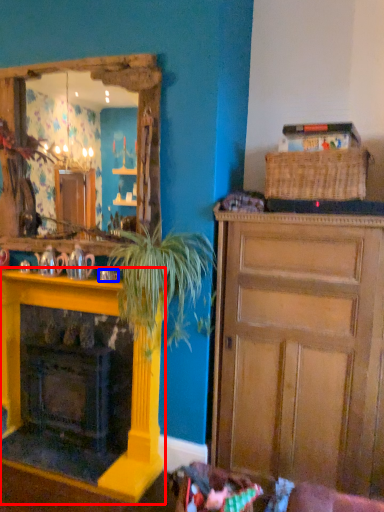
Question: Which object appears closest to the camera in this image, fireplace (highlighted by a red box) or coffee cup (highlighted by a blue box)?

Choices:
 (A) fireplace
 (B) coffee cup

Answer: (A)